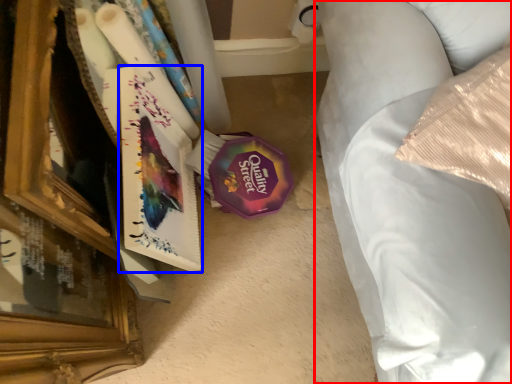
Question: Which of the following is the farthest to the observer, furniture (highlighted by a red box) or paperback book (highlighted by a blue box)?

Choices:
 (A) furniture
 (B) paperback book

Answer: (B)